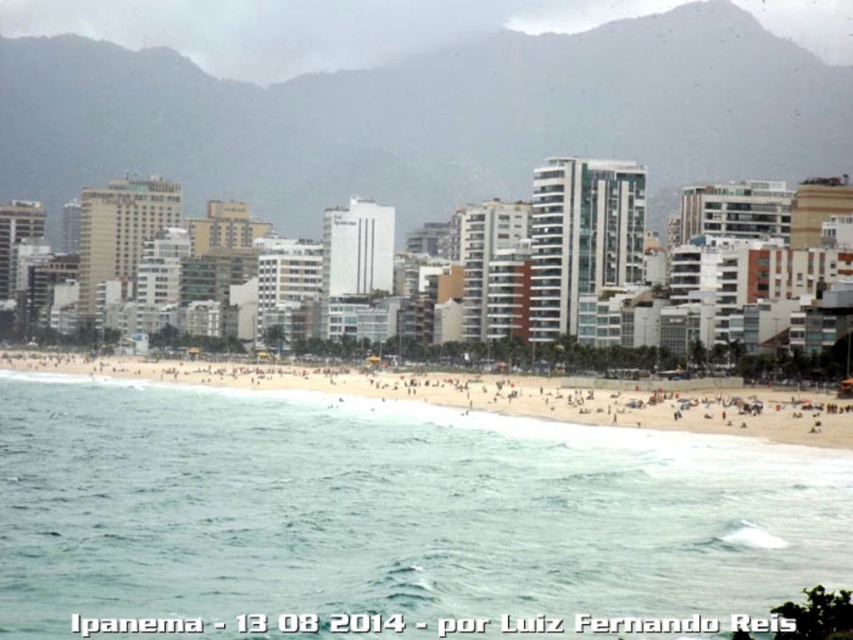
You are standing on the golden sand beach at center and want to walk towards the clear blue water at lower center. In which direction should you head?

You should head to the right because the clear blue water at lower center is located to the right of the golden sand beach at center.

You are standing on the beach at Ipanema Beach in Rio de Janeiro, Brazil. You see a point marked at coordinates (387, 509). What is located at this point?

The point at coordinates (387, 509) indicates clear blue water at lower center.